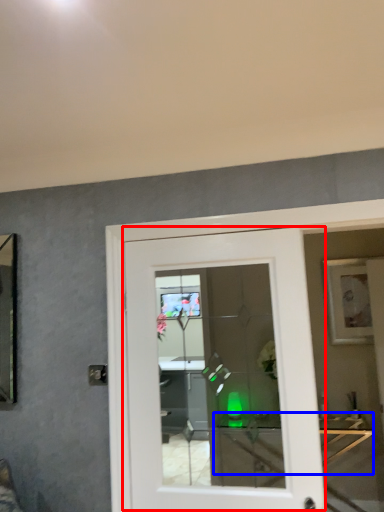
Question: Which point is closer to the camera, door (highlighted by a red box) or table (highlighted by a blue box)?

Choices:
 (A) door
 (B) table

Answer: (A)